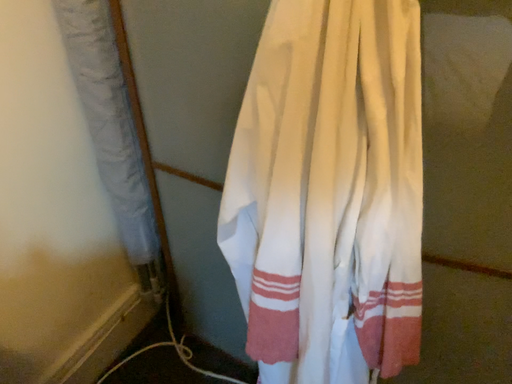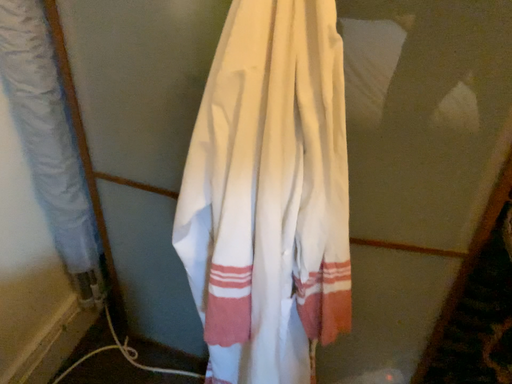
Question: Which way did the camera rotate in the video?

Choices:
 (A) rotated right
 (B) rotated left

Answer: (A)